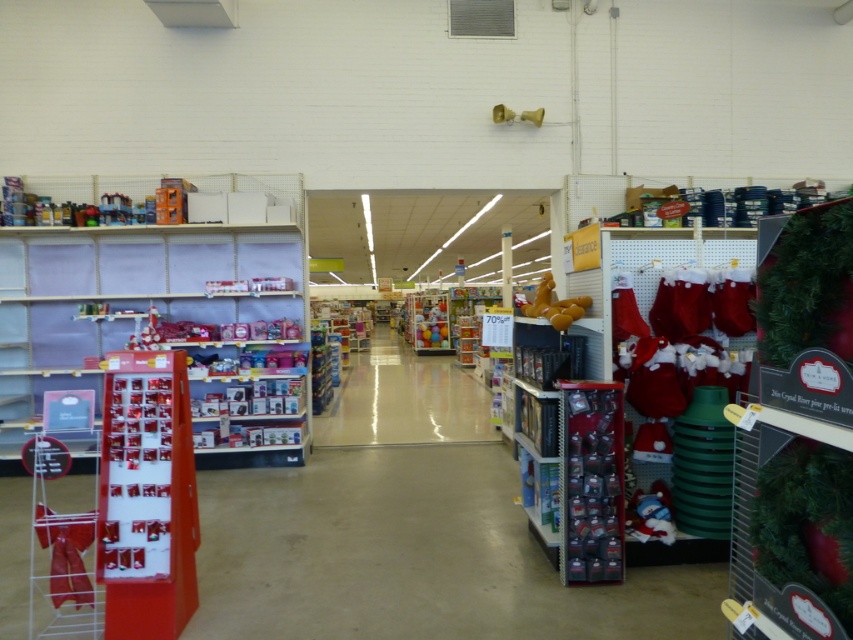
You are a store employee who needs to place a new box that is 10 cm thick in the space between the velvety plush toy at lower right and the matte yellow toy at upper center. Based on the current arrangement, will the box fit in that space?

The velvety plush toy at lower right is thinner than the matte yellow toy at upper center. Since the box is 10 cm thick, it depends on the actual thickness of the space between them. However, without specific measurements, we cannot confirm if it will fit. Please check the exact dimensions of the space.